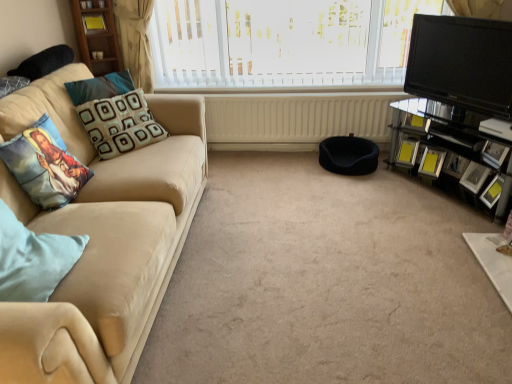
At what (x,y) coordinates should I click in order to perform the action: click on vacant region above cream matte radiator at center (from a real-world perspective). Please return your answer as a coordinate pair (x, y). The height and width of the screenshot is (384, 512). Looking at the image, I should click on (285, 89).